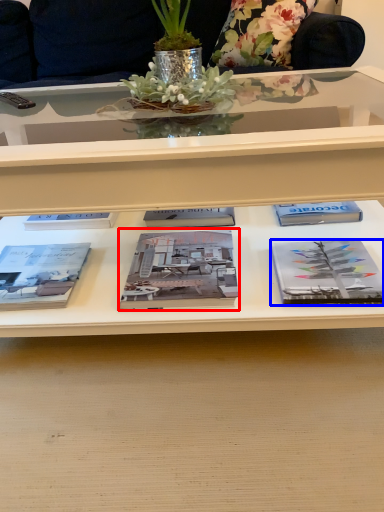
Question: Which of the following is the farthest to the observer, book (highlighted by a red box) or book (highlighted by a blue box)?

Choices:
 (A) book
 (B) book

Answer: (A)